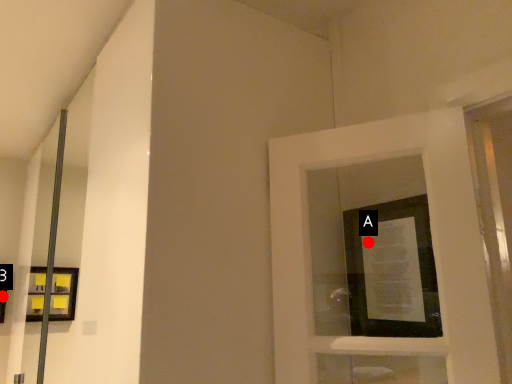
Question: Two points are circled on the image, labeled by A and B beside each circle. Which of the following is the farthest from the observer?

Choices:
 (A) A is further
 (B) B is further

Answer: (B)